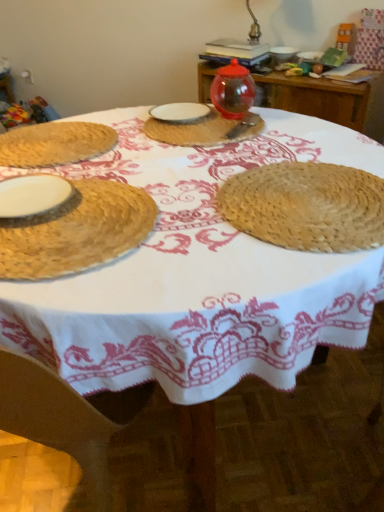
This screenshot has height=512, width=384. Find the location of `vacant area located to the right-hand side of woven straw placemat at left, arranged as the 1th table when viewed from the front`. vacant area located to the right-hand side of woven straw placemat at left, arranged as the 1th table when viewed from the front is located at coordinates (171, 152).